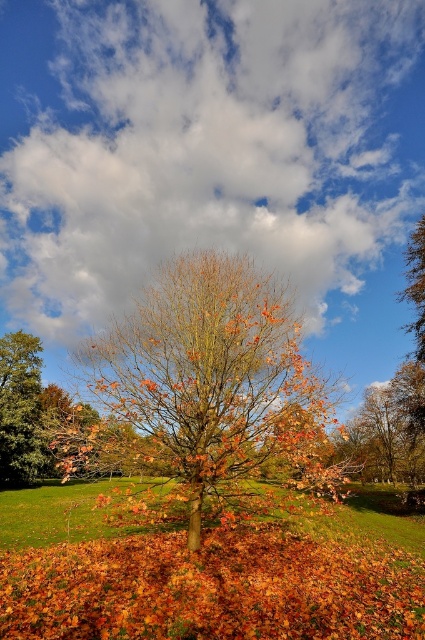
You are standing in the middle of the field and want to look up at the sky. Which direction should you turn to see the white fluffy cloud at upper center relative to the green grass at center?

You should turn to the right to see the white fluffy cloud at upper center because it is positioned on the right side of the green grass at center.